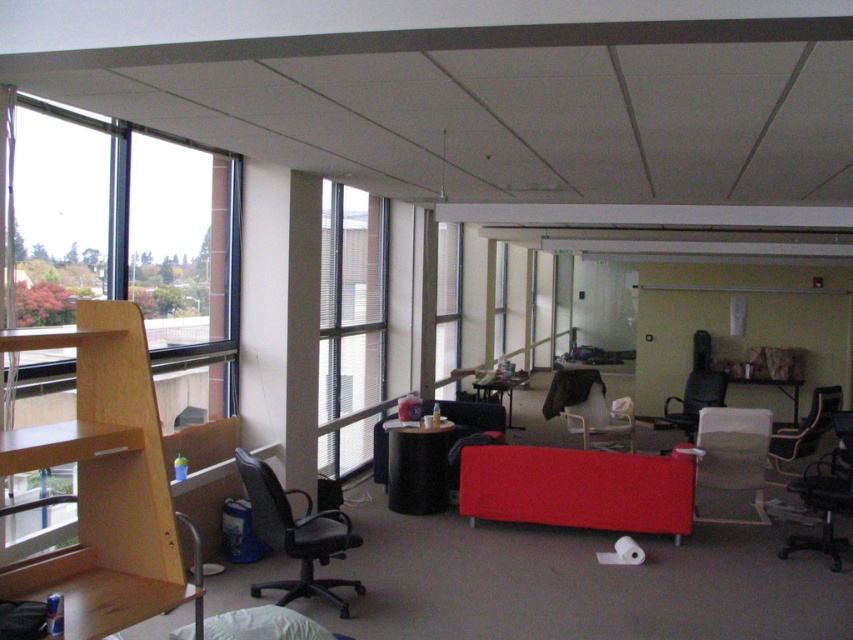
Does black leather swivel chair at center-left appear on the left side of black mesh office chair at right?

Correct, you'll find black leather swivel chair at center-left to the left of black mesh office chair at right.

Is black leather swivel chair at center-left further to camera compared to black mesh office chair at right?

No, it is in front of black mesh office chair at right.

Find the location of a particular element. The image size is (853, 640). black leather swivel chair at center-left is located at coordinates (294, 532).

Does clear glass window at upper left have a smaller size compared to matte plastic table at center?

Actually, clear glass window at upper left might be larger than matte plastic table at center.

Is point (190, 317) positioned before point (508, 397)?

Yes.

I want to click on clear glass window at upper left, so click(125, 241).

Who is lower down, clear glass window at upper left or transparent glass window at center?

transparent glass window at center is below.

Does clear glass window at upper left lie in front of transparent glass window at center?

Yes.

Between point (196, 385) and point (445, 296), which one is positioned behind?

Positioned behind is point (445, 296).

This screenshot has height=640, width=853. In order to click on clear glass window at upper left in this screenshot , I will do `click(125, 241)`.